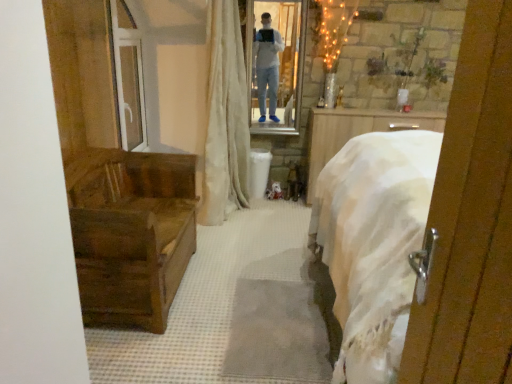
Question: Based on their sizes in the image, would you say white glossy mirror at upper center is bigger or smaller than transparent glass door at upper left?

Choices:
 (A) small
 (B) big

Answer: (A)

Question: Considering the positions of white glossy mirror at upper center and transparent glass door at upper left in the image, is white glossy mirror at upper center wider or thinner than transparent glass door at upper left?

Choices:
 (A) wide
 (B) thin

Answer: (B)

Question: Which is nearer to the white glossy mirror at upper center?

Choices:
 (A) beige fabric curtain at center
 (B) transparent glass door at upper left
 (C) wooden chest at left

Answer: (A)

Question: Estimate the real-world distances between objects in this image. Which object is farther from the transparent glass door at upper left?

Choices:
 (A) white glossy mirror at upper center
 (B) beige fabric curtain at center
 (C) wooden chest at left

Answer: (A)